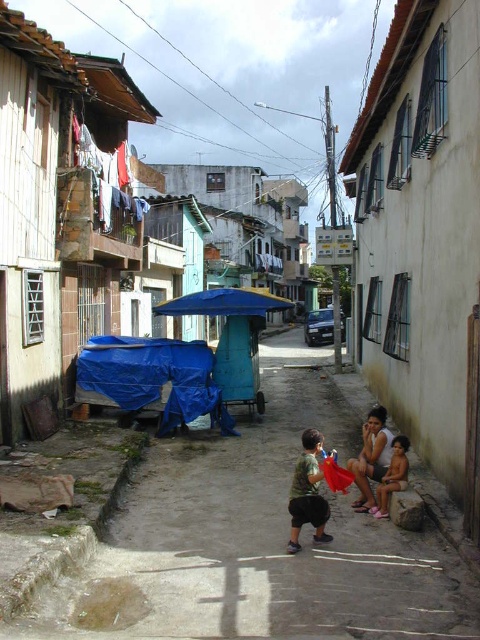
You are a delivery person with a cart that is 1.2 meters wide. You need to navigate through the alleyway to reach the delivery point at the end. The alley has a blue tarpaulin at lower left and a light brown skin at lower right. Which object should you avoid to ensure your cart can pass through the narrowest part of the alley?

The blue tarpaulin at lower left has a larger width than the light brown skin at lower right. To ensure your cart can pass through the narrowest part of the alley, you should avoid the blue tarpaulin at lower left since it occupies more space, leaving less room for the cart.

You are a delivery person with a 1.5 meter tall box. You need to pass through the alley and deliver it to the beige concrete hut at lower right. Can you safely carry the box past the camouflage fabric shirt at center without hitting anything?

The beige concrete hut at lower right is taller than the camouflage fabric shirt at center. Since the box is 1.5 meters tall, and the camouflage fabric shirt at center is shorter than the hut, the delivery person can safely carry the box past the camouflage fabric shirt at center as long as they keep the box upright and avoid any low hanging obstacles not mentioned in the scene description.

You are a delivery person with a cart that is 1.2 meters wide. You need to navigate through the alley between the beige concrete hut at lower right and the rusty corrugated metal hut at left. Can your cart fit through the space between them?

The beige concrete hut at lower right is wider than the rusty corrugated metal hut at left, but the exact width of the space between them isn